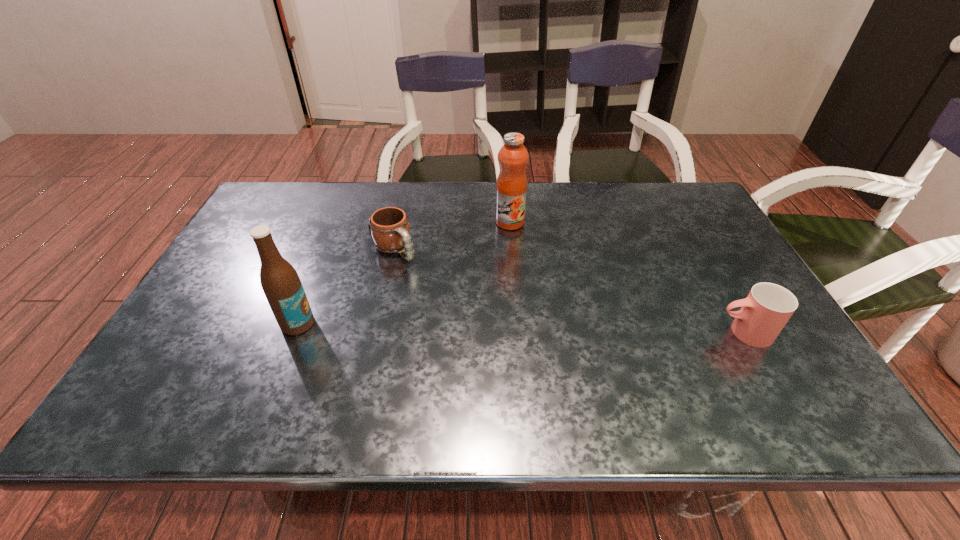
In order to click on vacant space at the near edge of the desktop in this screenshot , I will do `click(657, 370)`.

You are a GUI agent. You are given a task and a screenshot of the screen. Output one action in this format:
    pyautogui.click(x=<x>, y=<y>)
    Task: Click on the vacant space at the left edge
    This screenshot has height=540, width=960.
    Given the screenshot: What is the action you would take?
    pyautogui.click(x=250, y=245)

Where is `vacant space at the right edge of the desktop`? The height and width of the screenshot is (540, 960). vacant space at the right edge of the desktop is located at coordinates (737, 263).

Identify the location of vacant space at the near left corner. (187, 360).

In the image, there is a desktop. At what (x,y) coordinates should I click in order to perform the action: click on vacant area at the far right corner. Please return your answer as a coordinate pair (x, y). Looking at the image, I should click on (669, 221).

Identify the location of blank region between the mug and the leftmost object. [x=347, y=286].

I want to click on empty space between the third object from right to left and the beer bottle, so click(347, 286).

Where is `vacant space that's between the shortest object and the beer bottle`? vacant space that's between the shortest object and the beer bottle is located at coordinates (347, 286).

Identify the location of free space that is in between the beer bottle and the rightmost object. (520, 328).

You are a GUI agent. You are given a task and a screenshot of the screen. Output one action in this format:
    pyautogui.click(x=<x>, y=<y>)
    Task: Click on the vacant region between the leftmost object and the shortest object
    Image resolution: width=960 pixels, height=540 pixels.
    Given the screenshot: What is the action you would take?
    pyautogui.click(x=347, y=286)